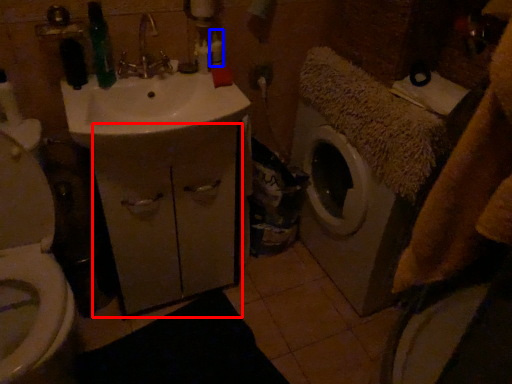
Question: Which object appears closest to the camera in this image, drawer (highlighted by a red box) or toiletry (highlighted by a blue box)?

Choices:
 (A) drawer
 (B) toiletry

Answer: (A)